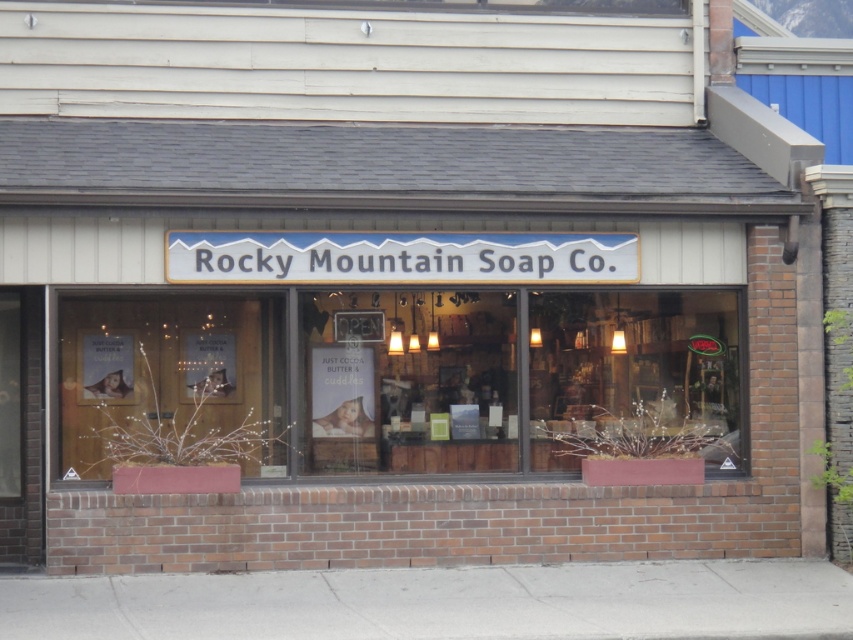
You are standing outside the entrance of Rocky Mountain Soap Co. and want to examine the wooden display case at center inside the store. Considering the distance between you and the display case, can you read the labels on the soaps displayed there without entering the store?

The wooden display case at center is 13.29 meters away from you. Since this distance is quite far, it would be difficult to read the labels on the soaps displayed there without entering the store and getting closer.

You are a delivery person trying to enter the store. You see the wooden door at center and the white plastic sign at center. Which object is taller?

The wooden door at center is taller than the white plastic sign at center.

What is the spatial relationship between the wooden door at center and the white plastic sign at center in the storefront of

The wooden door at center is located below the white plastic sign at center.